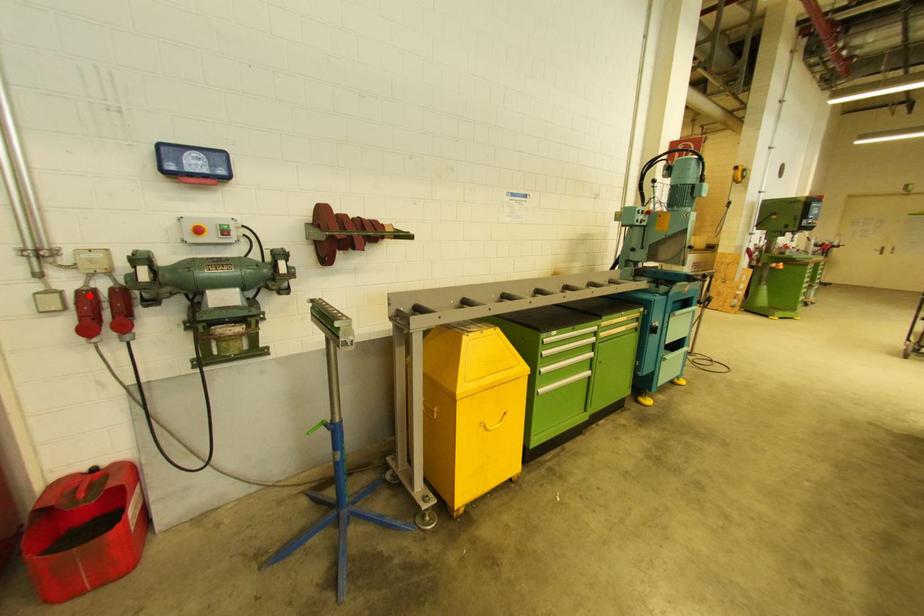
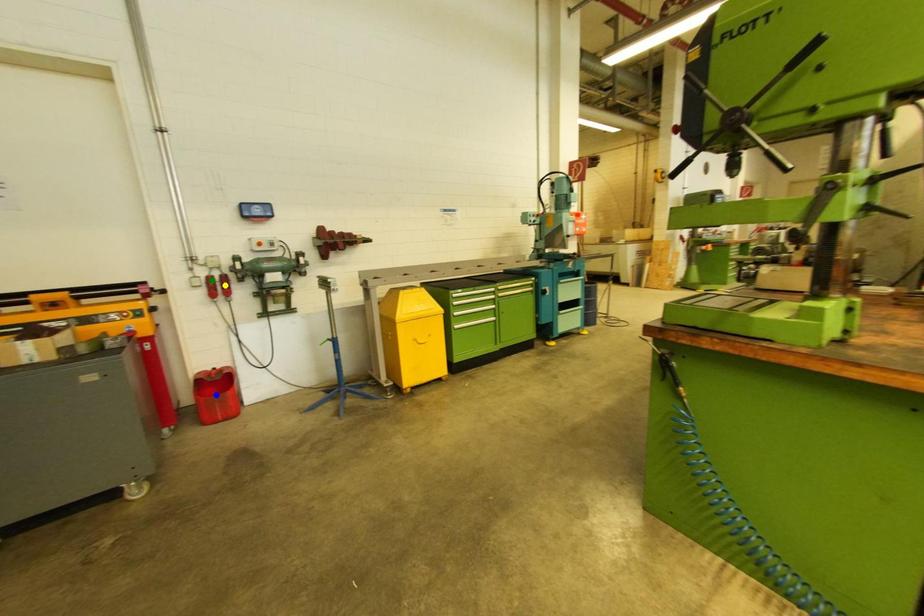
Question: I am providing you with two images of the same scene from different viewpoints. A red point is marked on the first image. You are given multiple points on the second image. Which spot in image 2 lines up with the point in image 1?

Choices:
 (A) blue point
 (B) green point
 (C) yellow point

Answer: (B)